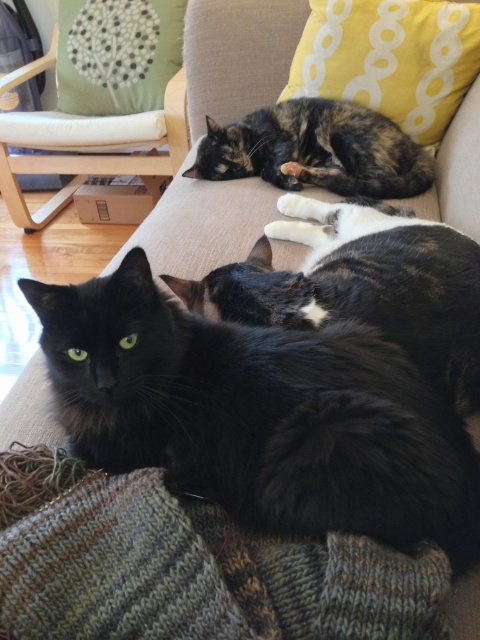
What do you see at coordinates (259, 413) in the screenshot? I see `black fluffy cat at lower left` at bounding box center [259, 413].

Does black fluffy cat at lower left have a smaller size compared to yellow dotted pillow at upper right?

Indeed, black fluffy cat at lower left has a smaller size compared to yellow dotted pillow at upper right.

Does point (397, 397) lie in front of point (443, 104)?

That is True.

Locate an element on the screen. The image size is (480, 640). black fluffy cat at lower left is located at coordinates (259, 413).

Can you confirm if black fluffy cat at lower left is wider than tortoiseshell fur cat at upper center?

Incorrect, black fluffy cat at lower left's width does not surpass tortoiseshell fur cat at upper center's.

Who is more forward, (384, 404) or (420, 193)?

Point (384, 404) is in front.

Measure the distance between point (245,497) and camera.

A distance of 28.50 inches exists between point (245,497) and camera.

This screenshot has width=480, height=640. What are the coordinates of `black fluffy cat at lower left` in the screenshot? It's located at (259, 413).

Is black fluffy cat at lower left bigger than knitted woolen blanket at lower left?

Yes, black fluffy cat at lower left is bigger than knitted woolen blanket at lower left.

Is black fluffy cat at lower left smaller than knitted woolen blanket at lower left?

No, black fluffy cat at lower left is not smaller than knitted woolen blanket at lower left.

Between point (142, 324) and point (23, 524), which one is positioned in front?

Point (23, 524)

You are a GUI agent. You are given a task and a screenshot of the screen. Output one action in this format:
    pyautogui.click(x=<x>, y=<y>)
    Task: Click on the black fluffy cat at lower left
    Image resolution: width=480 pixels, height=640 pixels.
    Given the screenshot: What is the action you would take?
    pyautogui.click(x=259, y=413)